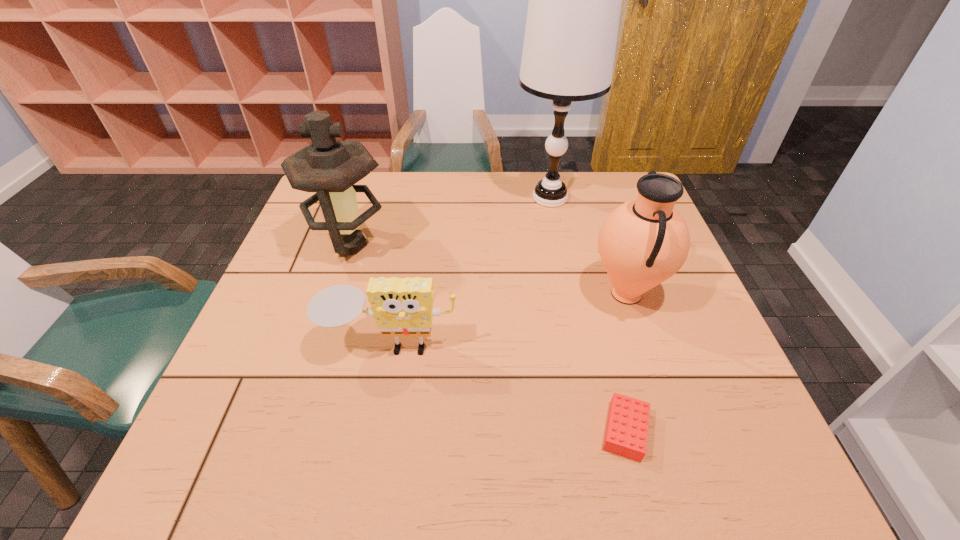
Where is `table lamp`? table lamp is located at coordinates (574, 7).

The image size is (960, 540). What are the coordinates of `the farthest object` in the screenshot? It's located at (574, 7).

The width and height of the screenshot is (960, 540). Identify the location of oil lamp. (330, 167).

This screenshot has width=960, height=540. I want to click on pitcher, so click(x=643, y=242).

Locate an element on the screen. The image size is (960, 540). the second shortest object is located at coordinates (403, 307).

The width and height of the screenshot is (960, 540). I want to click on Lego, so click(626, 433).

This screenshot has width=960, height=540. In order to click on the shortest object in this screenshot , I will do `click(626, 433)`.

Find the location of a particular element. free space located 0.070m on the right of the farthest object is located at coordinates (611, 198).

Locate an element on the screen. Image resolution: width=960 pixels, height=540 pixels. vacant region located on the front of the fourth shortest object is located at coordinates (316, 350).

Locate an element on the screen. This screenshot has width=960, height=540. vacant space located on the back of the third tallest object is located at coordinates (595, 200).